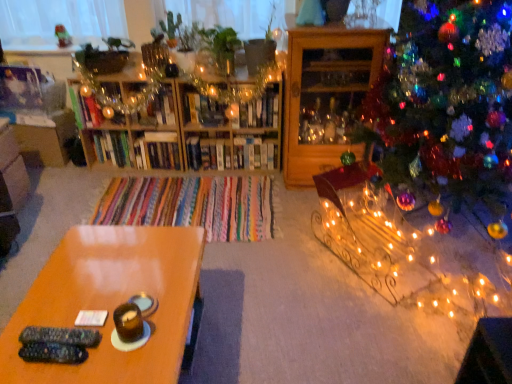
Question: Considering the positions of glossy wood table at lower left and wooden bookshelf at center, placed as the first shelf when sorted from left to right, in the image, is glossy wood table at lower left taller or shorter than wooden bookshelf at center, placed as the first shelf when sorted from left to right,?

Choices:
 (A) tall
 (B) short

Answer: (B)

Question: Considering the positions of point (59, 291) and point (234, 168), is point (59, 291) closer or farther from the camera than point (234, 168)?

Choices:
 (A) farther
 (B) closer

Answer: (B)

Question: Considering the real-world distances, which object is closest to the wooden cabinet at right, arranged as the first shelf when viewed from the right?

Choices:
 (A) glossy wood table at lower left
 (B) iridescent glass ornaments at right
 (C) white glossy bookshelf at center, acting as the 2th shelf starting from the left
 (D) wooden bookshelf at center, placed as the first shelf when sorted from left to right

Answer: (D)

Question: Considering the real-world distances, which object is farthest from the wooden bookshelf at center, the third shelf when ordered from right to left?

Choices:
 (A) wooden cabinet at right, the 3th shelf in the left-to-right sequence
 (B) iridescent glass ornaments at right
 (C) white glossy bookshelf at center, the second shelf when ordered from right to left
 (D) glossy wood table at lower left

Answer: (D)